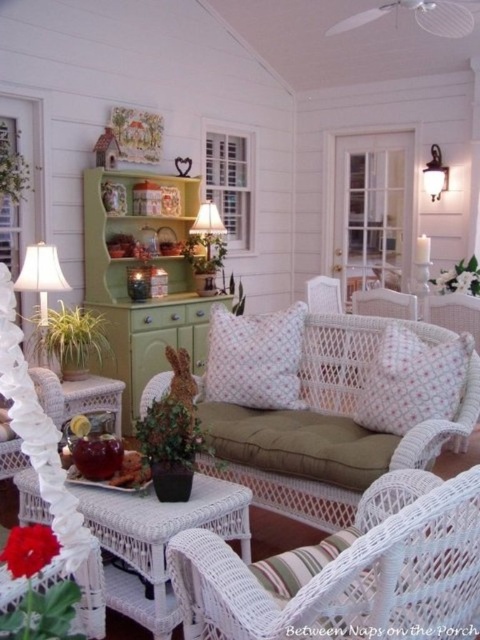
You are rearranging the sunroom and want to move the white dotted pillow at center closer to the white fabric lampshade at left. Based on their current positions, which object would you need to move first to create space?

The white dotted pillow at center is in front of the white fabric lampshade at left, so you should move the white dotted pillow at center first to create space.

From the picture: You are a delivery person who needs to place a 9 foot long ladder between the white dotted pillow at center and the white matte wall sconce at upper right. Can the ladder fit between them without bending?

The distance between the white dotted pillow at center and the white matte wall sconce at upper right is 8.99 feet, which is slightly shorter than the 9 foot ladder. Therefore, the ladder cannot fit between them without bending.